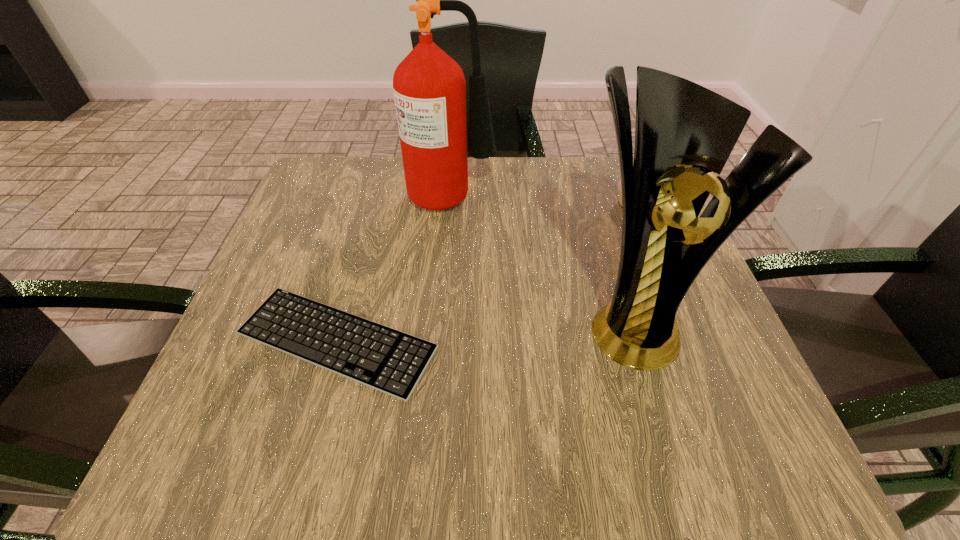
At what (x,y) coordinates should I click in order to perform the action: click on object located at the left edge. Please return your answer as a coordinate pair (x, y). This screenshot has height=540, width=960. Looking at the image, I should click on (380, 357).

Locate an element on the screen. The height and width of the screenshot is (540, 960). award that is at the right edge is located at coordinates (684, 133).

In order to click on cupcake that is at the right edge in this screenshot , I will do `click(619, 183)`.

This screenshot has height=540, width=960. Identify the location of object at the far right corner. (619, 183).

Locate an element on the screen. This screenshot has height=540, width=960. free space at the far edge is located at coordinates (499, 162).

You are a GUI agent. You are given a task and a screenshot of the screen. Output one action in this format:
    pyautogui.click(x=<x>, y=<y>)
    Task: Click on the free location at the near edge
    Image resolution: width=960 pixels, height=540 pixels.
    Given the screenshot: What is the action you would take?
    pyautogui.click(x=549, y=471)

In the image, there is a desktop. Identify the location of vacant space at the left edge. (302, 270).

In the image, there is a desktop. At what (x,y) coordinates should I click in order to perform the action: click on vacant space at the right edge. Please return your answer as a coordinate pair (x, y). Image resolution: width=960 pixels, height=540 pixels. Looking at the image, I should click on (698, 321).

At what (x,y) coordinates should I click in order to perform the action: click on free spot at the far left corner of the desktop. Please return your answer as a coordinate pair (x, y). Looking at the image, I should click on (363, 168).

You are a GUI agent. You are given a task and a screenshot of the screen. Output one action in this format:
    pyautogui.click(x=<x>, y=<y>)
    Task: Click on the free space at the near left corner of the desktop
    This screenshot has height=540, width=960.
    Given the screenshot: What is the action you would take?
    click(237, 410)